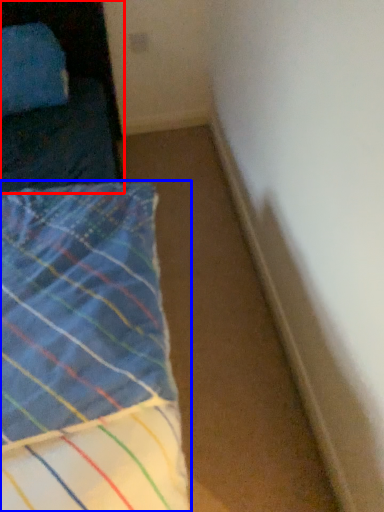
Question: Which object appears closest to the camera in this image, furniture (highlighted by a red box) or bed (highlighted by a blue box)?

Choices:
 (A) furniture
 (B) bed

Answer: (B)